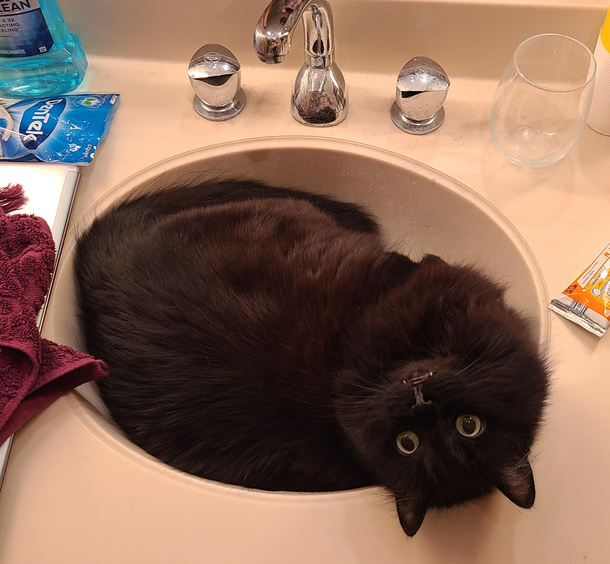
Where is `drinking glass`? The image size is (610, 564). drinking glass is located at coordinates (533, 126).